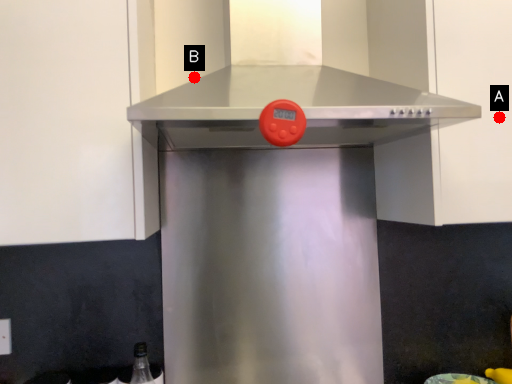
Question: Two points are circled on the image, labeled by A and B beside each circle. Which point is further to the camera?

Choices:
 (A) A is further
 (B) B is further

Answer: (B)